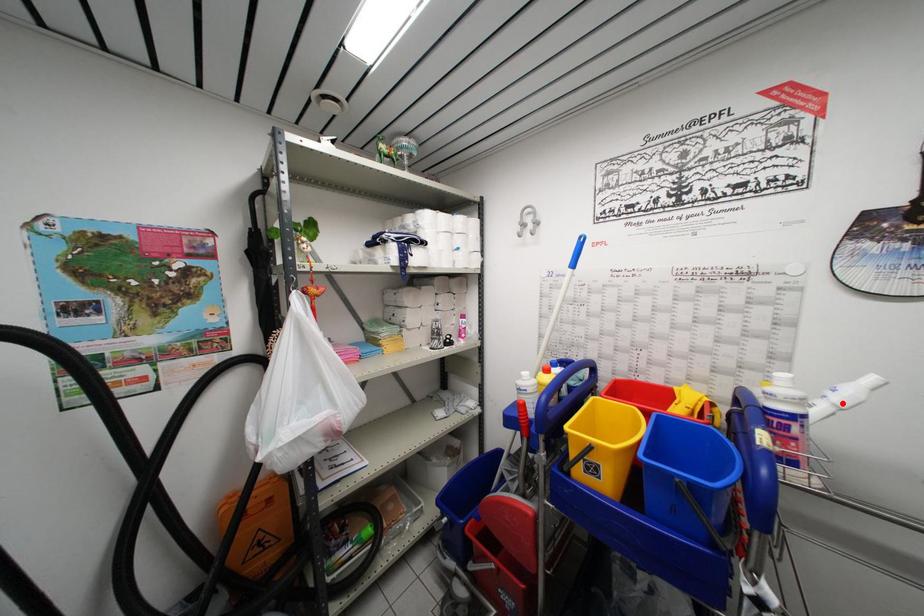
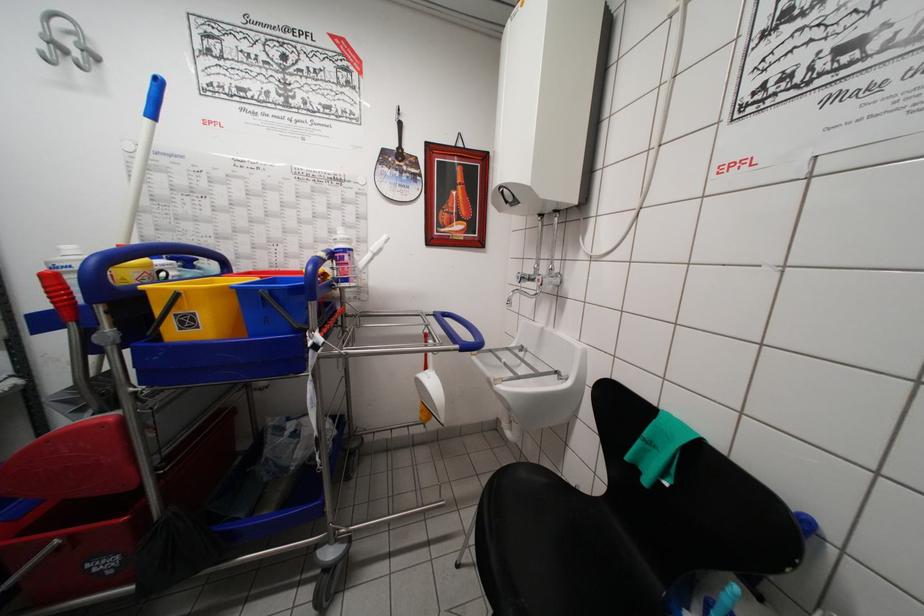
Find the pixel in the second image that matches the highlighted location in the first image.

(377, 253)